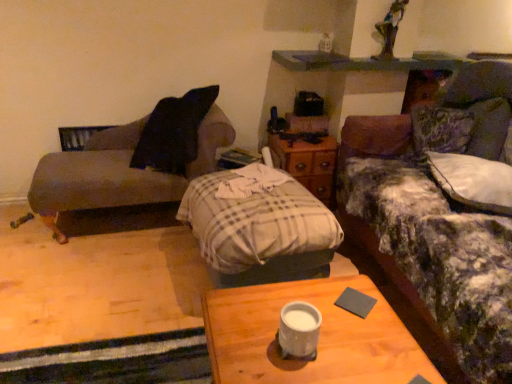
Locate an element on the screen. The width and height of the screenshot is (512, 384). free space between matte brown couch at left, which is the 1th studio couch from left to right, and plaid fabric pillow at center is located at coordinates (136, 272).